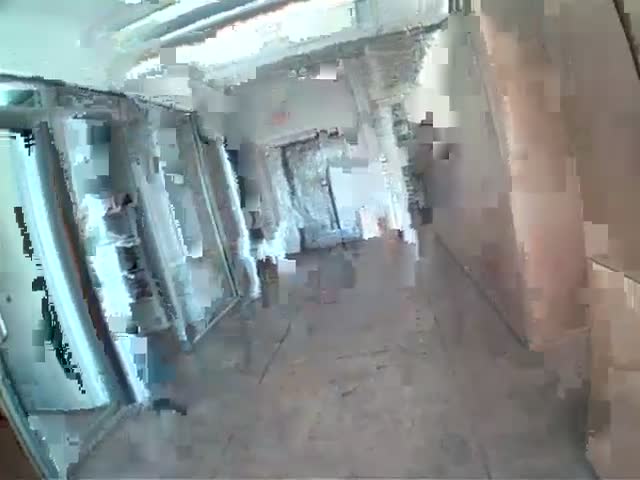
Where is `lights on ceiling`? lights on ceiling is located at coordinates (300, 64).